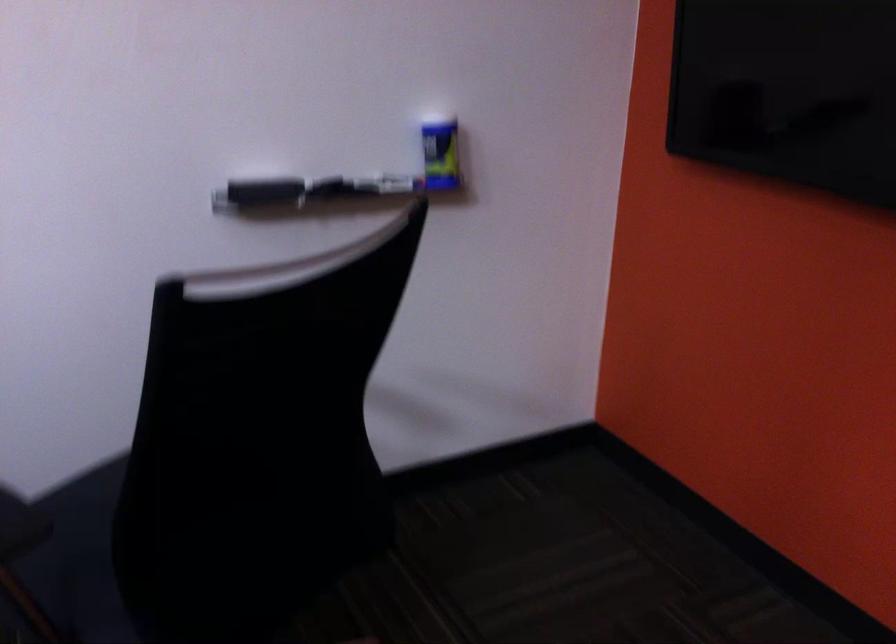
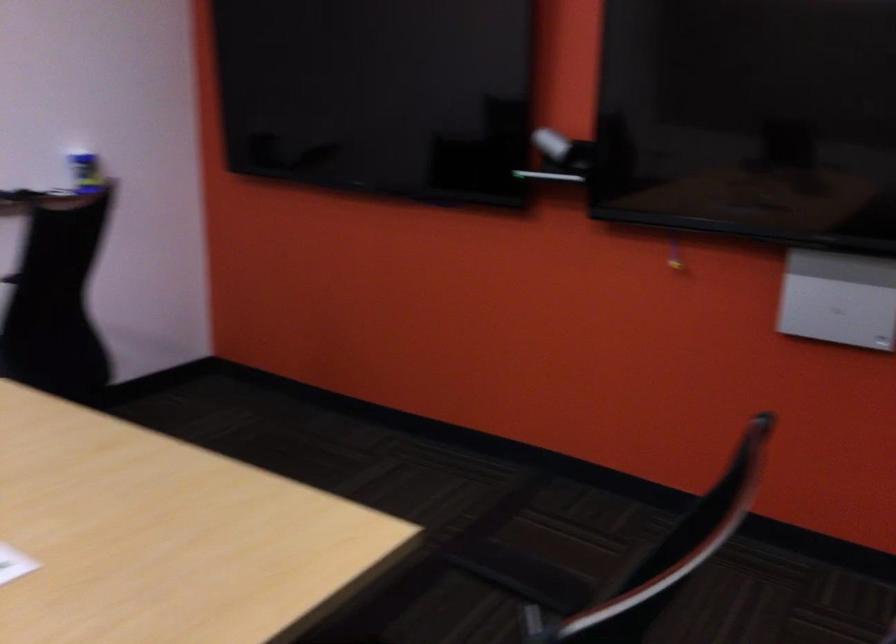
The point at (416,176) is marked in the first image. Where is the corresponding point in the second image?

(85, 172)